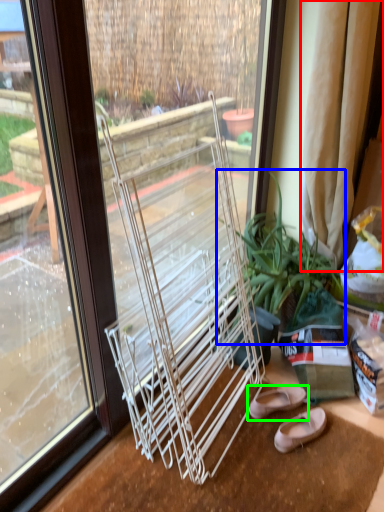
Question: Which object is the closest to the curtain (highlighted by a red box)? Choose among these: houseplant (highlighted by a blue box) or footwear (highlighted by a green box).

Choices:
 (A) houseplant
 (B) footwear

Answer: (A)